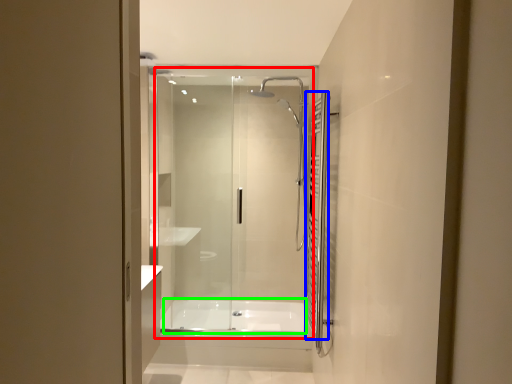
Question: Which object is the closest to the glass door (highlighted by a red box)? Choose among these: shower curtain (highlighted by a blue box) or bath (highlighted by a green box).

Choices:
 (A) shower curtain
 (B) bath

Answer: (B)